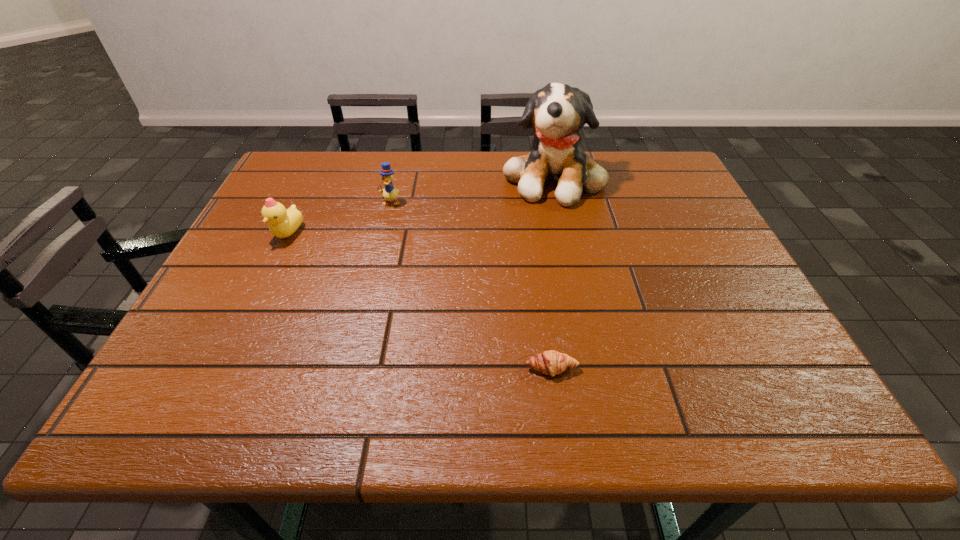
Find the location of a particular element. The height and width of the screenshot is (540, 960). object that is the third closest to the second object from left to right is located at coordinates (550, 362).